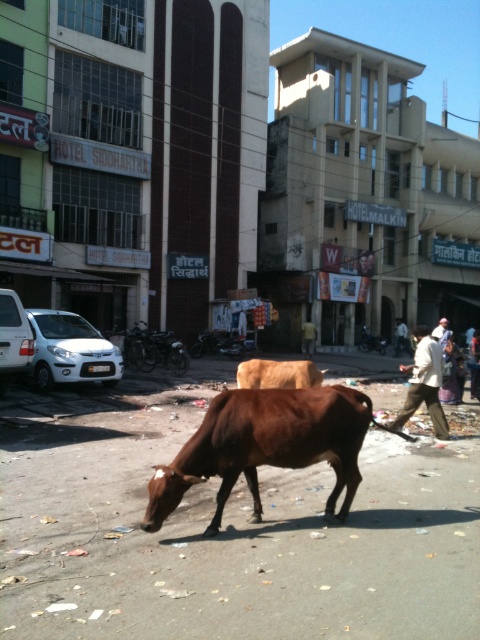
You are a delivery person trying to navigate through the urban street scene. You need to pass between the brown matte bull at center and the light beige pants at center. The width of your delivery cart is 1.2 meters. Can you fit through the space between them?

The brown matte bull at center is narrower than the light beige pants at center. However, since the exact width of the space between them isn

You are a delivery person who needs to navigate between the brown matte bull at center and the light beige pants at center. Which direction should you move to go from the bull to the pants?

To move from the brown matte bull at center to the light beige pants at center, you should move to the right since the brown matte bull at center is positioned to the left of the light beige pants at center.